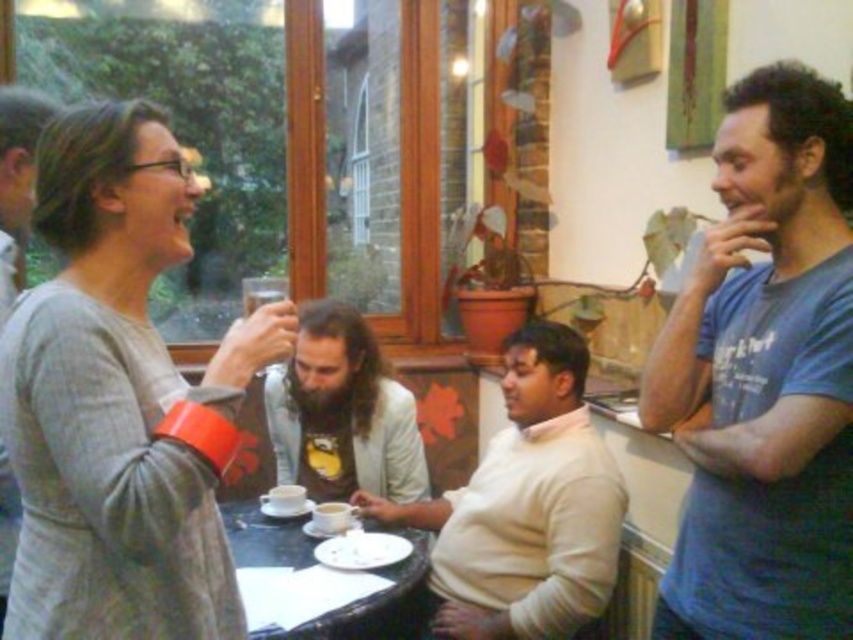
Question: Which point is farther from the camera taking this photo?

Choices:
 (A) (543, 500)
 (B) (338, 372)
 (C) (721, 253)
 (D) (381, 604)

Answer: (B)

Question: Which of the following is the farthest from the observer?

Choices:
 (A) (579, 515)
 (B) (396, 609)

Answer: (A)

Question: Which point is farther to the camera?

Choices:
 (A) (271, 490)
 (B) (260, 298)
 (C) (119, 604)
 (D) (10, 513)

Answer: (B)

Question: Can you confirm if gray matte sweater at upper left is positioned to the left of white matte sweater at center?

Choices:
 (A) no
 (B) yes

Answer: (B)

Question: Can you confirm if white matte sweater at center is wider than beige fabric shirt at center?

Choices:
 (A) no
 (B) yes

Answer: (B)

Question: Is gray matte sweater at upper left positioned at the back of white ceramic cup at center?

Choices:
 (A) no
 (B) yes

Answer: (A)